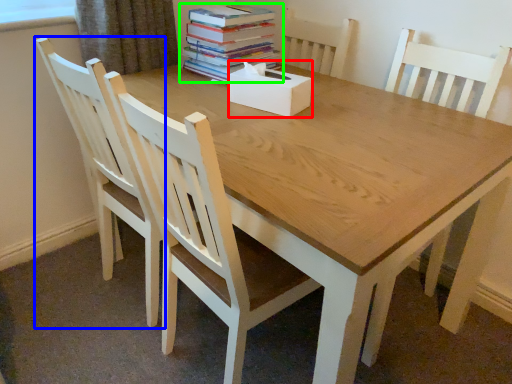
Question: Which object is positioned farthest from box (highlighted by a red box)? Select from chair (highlighted by a blue box) and book (highlighted by a green box).

Choices:
 (A) chair
 (B) book

Answer: (A)